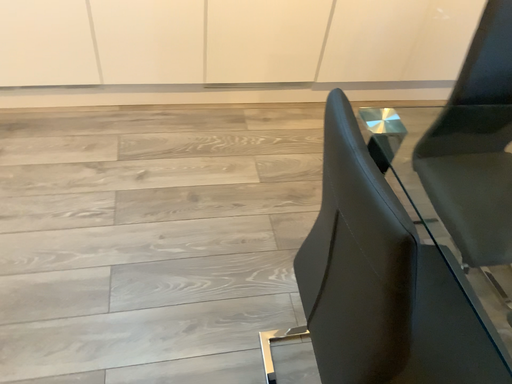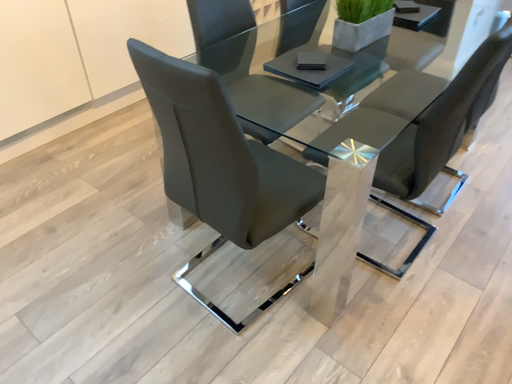
Question: Which way did the camera rotate in the video?

Choices:
 (A) rotated right
 (B) rotated left

Answer: (A)